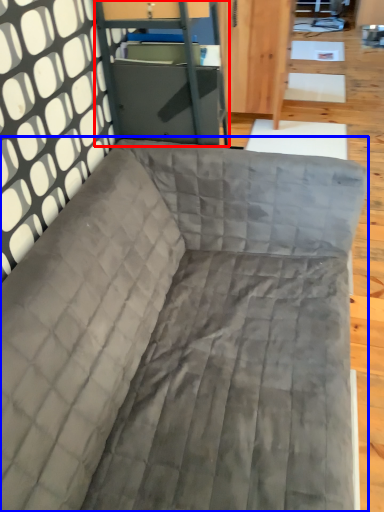
Question: Among these objects, which one is nearest to the camera, file cabinet (highlighted by a red box) or studio couch (highlighted by a blue box)?

Choices:
 (A) file cabinet
 (B) studio couch

Answer: (B)